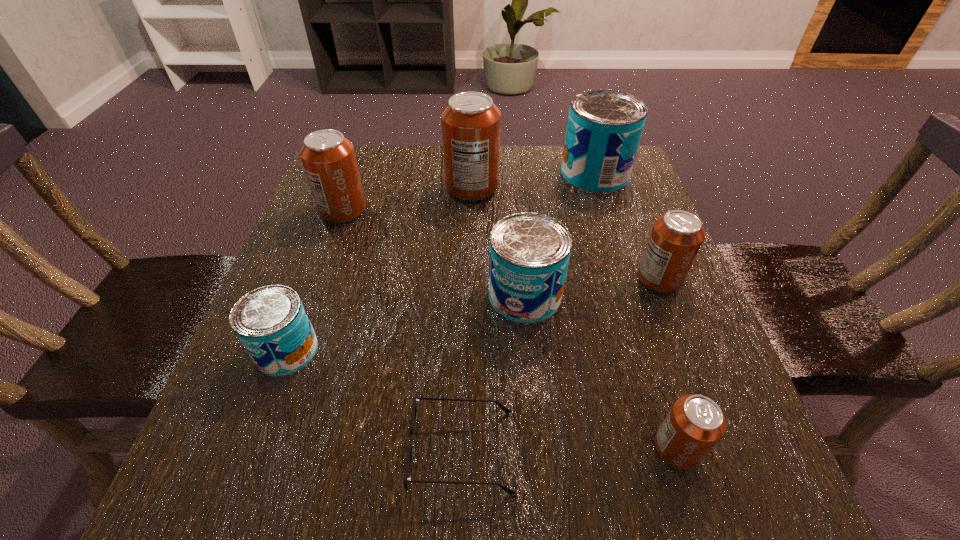
Locate an element on the screen. vacant space at the far left corner is located at coordinates (368, 168).

Identify the location of empty location between the second orange can from left to right and the leftmost orange can. (407, 199).

Find the location of a particular element. This screenshot has height=540, width=960. free space that is in between the second blue can from right to left and the smallest orange can is located at coordinates (601, 372).

The height and width of the screenshot is (540, 960). What are the coordinates of `empty location between the shortest object and the leftmost orange can` in the screenshot? It's located at (402, 330).

You are a GUI agent. You are given a task and a screenshot of the screen. Output one action in this format:
    pyautogui.click(x=<x>, y=<y>)
    Task: Click on the vacant area that lies between the biggest blue can and the sixth farthest object
    This screenshot has height=540, width=960.
    Given the screenshot: What is the action you would take?
    pyautogui.click(x=441, y=262)

Find the location of a particular element. This screenshot has width=960, height=540. unoccupied area between the biggest orange can and the nearest orange can is located at coordinates (574, 318).

The image size is (960, 540). I want to click on empty space that is in between the nearest blue can and the rightmost blue can, so click(441, 262).

Locate an element on the screen. Image resolution: width=960 pixels, height=540 pixels. free spot between the spectacles and the second orange can from left to right is located at coordinates (468, 319).

Find the location of a particular element. The width and height of the screenshot is (960, 540). free spot between the tallest object and the leftmost blue can is located at coordinates (379, 269).

At what (x,y) coordinates should I click in order to perform the action: click on vacant space in between the nearest blue can and the second blue can from left to right. Please return your answer as a coordinate pair (x, y). The width and height of the screenshot is (960, 540). Looking at the image, I should click on (406, 323).